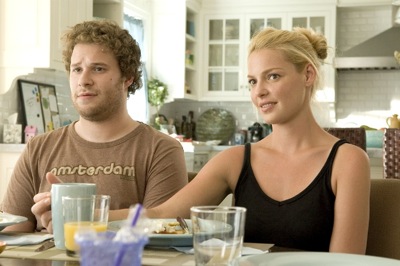
Identify the location of table. (50, 262).